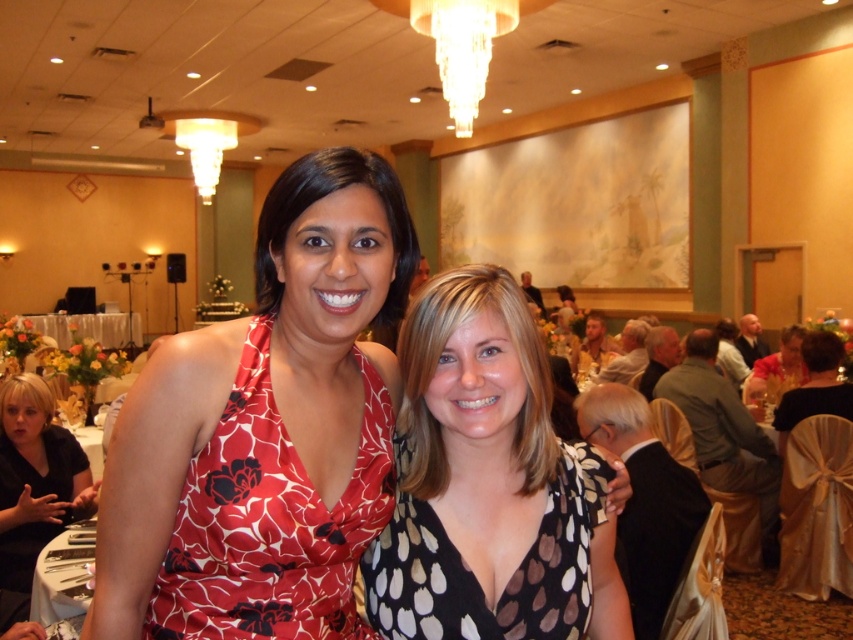
You are a photographer at the event and want to capture a clear photo of both the red floral fabric dress at center and the black dotted dress at center. Which dress might be partially hidden in the photo due to their positions?

The black dotted dress at center might be partially hidden because the red floral fabric dress at center is in front of it.

You are a photographer at a formal event and need to arrange two dresses in the center of the image. The black dotted dress at center and the floral dress at center must be placed in a specific order. According to the scene description, which dress should be placed to the left of the other?

The black dotted dress at center should be placed to the left of the floral dress at center because the black dotted dress at center is positioned on the left side of floral dress at center in the scene.

You are standing at the entrance of the banquet hall and see two points marked in the image. The first point is labeled as point (345, 573) and the second is point (456, 637). According to the image, which point is closer to you?

Point (456, 637) is closer to you because the description states that point (345, 573) is behind point (456, 637).